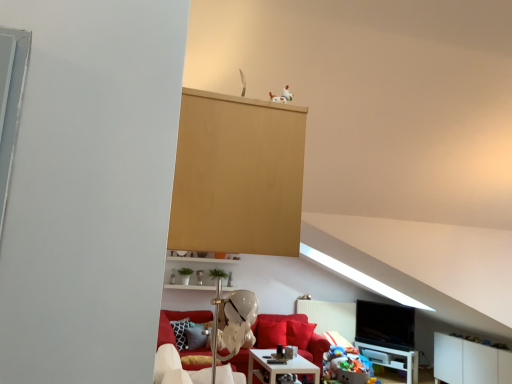
Question: Considering their positions, is white matte dog at upper center located in front of or behind white glossy table at lower right, positioned as the 2th table in top-to-bottom order?

Choices:
 (A) front
 (B) behind

Answer: (A)

Question: Looking at their shapes, would you say white matte dog at upper center is wider or thinner than white glossy table at lower right, acting as the second table starting from the front?

Choices:
 (A) wide
 (B) thin

Answer: (B)

Question: Estimate the real-world distances between objects in this image. Which object is closer to the white matte dog at upper center?

Choices:
 (A) white plastic swivel chair at lower center
 (B) velvet red couch at center
 (C) white matte cabinet at lower right
 (D) multicolored plush toys at lower right
 (E) light wood dresser at upper center

Answer: (E)

Question: Estimate the real-world distances between objects in this image. Which object is farther from the light wood dresser at upper center?

Choices:
 (A) white plastic swivel chair at lower center
 (B) multicolored plush toys at lower right
 (C) white matte dog at upper center
 (D) white glossy table at lower center, the second table when ordered from bottom to top
 (E) black glossy tv at lower right

Answer: (E)